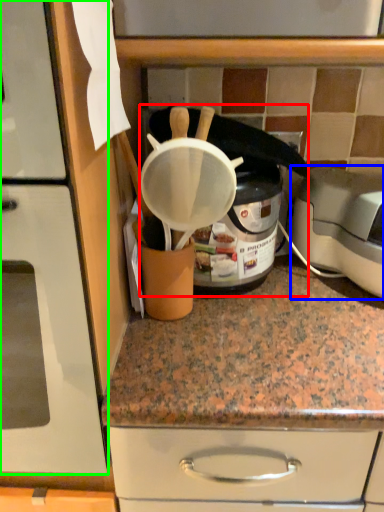
Question: Which object is positioned farthest from appliance (highlighted by a red box)? Select from toaster (highlighted by a blue box) and home appliance (highlighted by a green box).

Choices:
 (A) toaster
 (B) home appliance

Answer: (B)